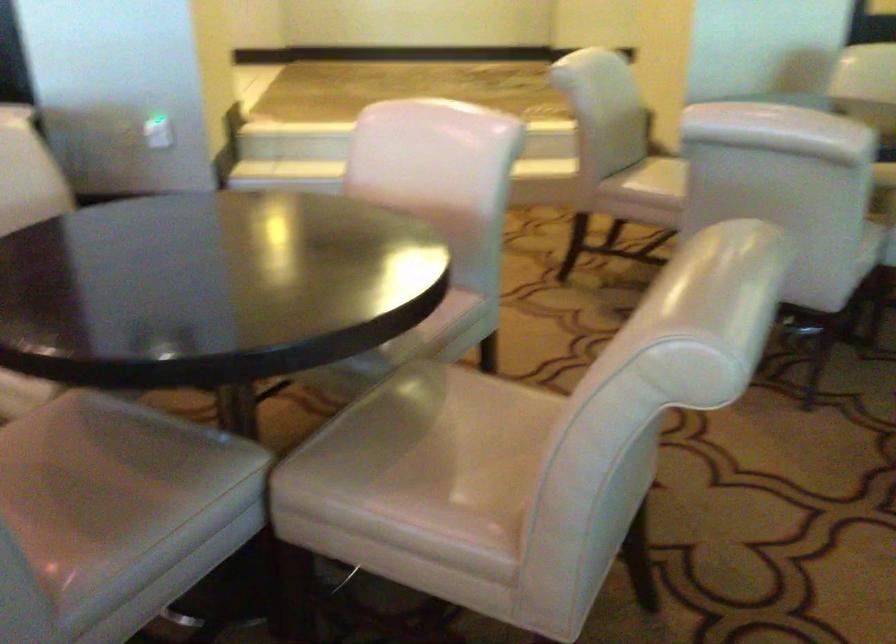
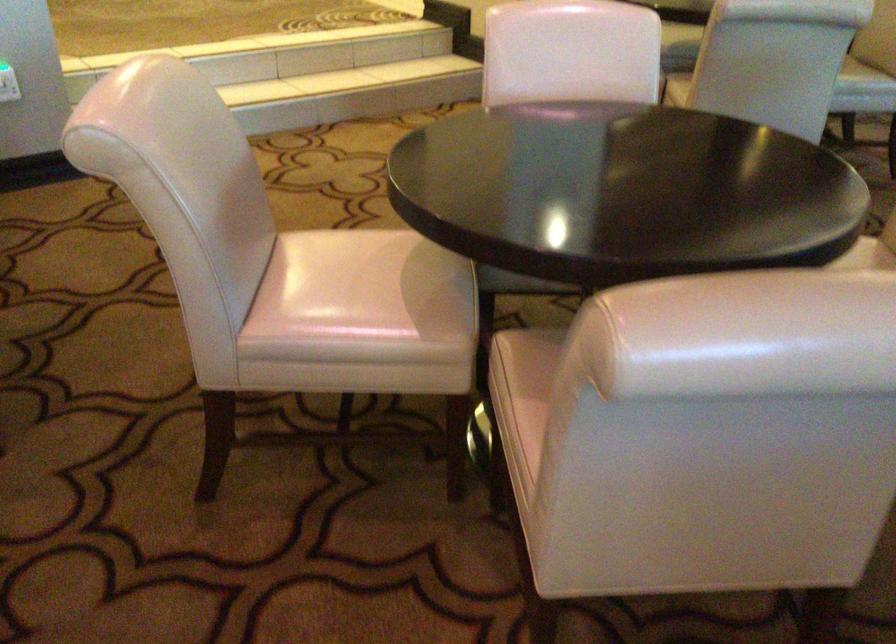
Locate, in the second image, the point that corresponds to the point at 69,422 in the first image.

(538, 351)